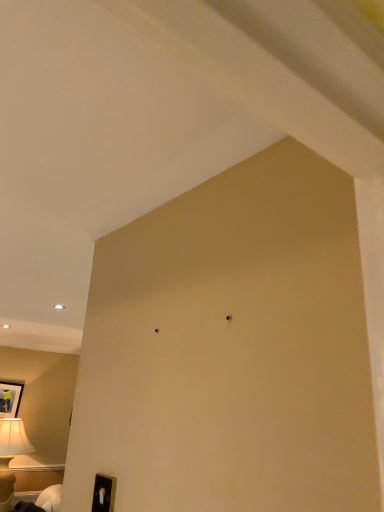
Where is `matte black picture frame at lower left`? The width and height of the screenshot is (384, 512). matte black picture frame at lower left is located at coordinates (10, 398).

The height and width of the screenshot is (512, 384). What do you see at coordinates (10, 398) in the screenshot?
I see `matte black picture frame at lower left` at bounding box center [10, 398].

Identify the location of white glossy lampshade at lower left. This screenshot has height=512, width=384. (41, 500).

What do you see at coordinates (41, 500) in the screenshot? I see `white glossy lampshade at lower left` at bounding box center [41, 500].

Find the location of a particular element. Image resolution: width=384 pixels, height=512 pixels. matte black picture frame at lower left is located at coordinates (10, 398).

Based on their positions, is white glossy lampshade at lower left located to the left or right of matte black picture frame at lower left?

white glossy lampshade at lower left is to the right of matte black picture frame at lower left.

Which is in front, white glossy lampshade at lower left or matte black picture frame at lower left?

Positioned in front is white glossy lampshade at lower left.

Between point (46, 509) and point (6, 389), which one is positioned behind?

The point (6, 389) is farther from the camera.

From the image's perspective, which one is positioned lower, white glossy lampshade at lower left or matte black picture frame at lower left?

white glossy lampshade at lower left appears lower in the image.

From the picture: From a real-world perspective, is white glossy lampshade at lower left positioned above or below matte black picture frame at lower left?

white glossy lampshade at lower left is below matte black picture frame at lower left.

Considering the relative sizes of white glossy lampshade at lower left and matte black picture frame at lower left in the image provided, is white glossy lampshade at lower left thinner than matte black picture frame at lower left?

In fact, white glossy lampshade at lower left might be wider than matte black picture frame at lower left.

In terms of height, does white glossy lampshade at lower left look taller or shorter compared to matte black picture frame at lower left?

Considering their sizes, white glossy lampshade at lower left has less height than matte black picture frame at lower left.

Based on the photo, is white glossy lampshade at lower left bigger or smaller than matte black picture frame at lower left?

Clearly, white glossy lampshade at lower left is larger in size than matte black picture frame at lower left.

Would you say white glossy lampshade at lower left is outside matte black picture frame at lower left?

Yes, white glossy lampshade at lower left is outside of matte black picture frame at lower left.

Can you see white glossy lampshade at lower left touching matte black picture frame at lower left?

white glossy lampshade at lower left is not next to matte black picture frame at lower left, and they're not touching.

Is white glossy lampshade at lower left looking in the opposite direction of matte black picture frame at lower left?

No, white glossy lampshade at lower left is not facing the opposite direction of matte black picture frame at lower left.

Image resolution: width=384 pixels, height=512 pixels. Find the location of `picture frame located above the white glossy lampshade at lower left (from the image's perspective)`. picture frame located above the white glossy lampshade at lower left (from the image's perspective) is located at coordinates (10, 398).

Which object is positioned more to the right, matte black picture frame at lower left or white glossy lampshade at lower left?

white glossy lampshade at lower left.

Which is in front, matte black picture frame at lower left or white glossy lampshade at lower left?

Positioned in front is white glossy lampshade at lower left.

Which is in front, point (0, 405) or point (44, 489)?

The point (44, 489) is more forward.

From the image's perspective, which one is positioned lower, matte black picture frame at lower left or white glossy lampshade at lower left?

From the image's view, white glossy lampshade at lower left is below.

From a real-world perspective, is matte black picture frame at lower left located beneath white glossy lampshade at lower left?

No, from a real-world perspective, matte black picture frame at lower left is not below white glossy lampshade at lower left.

Does matte black picture frame at lower left have a lesser width compared to white glossy lampshade at lower left?

Indeed, matte black picture frame at lower left has a lesser width compared to white glossy lampshade at lower left.

Which of these two, matte black picture frame at lower left or white glossy lampshade at lower left, stands shorter?

With less height is white glossy lampshade at lower left.

Can you confirm if matte black picture frame at lower left is bigger than white glossy lampshade at lower left?

Actually, matte black picture frame at lower left might be smaller than white glossy lampshade at lower left.

Which is correct: matte black picture frame at lower left is inside white glossy lampshade at lower left, or outside of it?

matte black picture frame at lower left is not enclosed by white glossy lampshade at lower left.

Are matte black picture frame at lower left and white glossy lampshade at lower left far apart?

Yes, matte black picture frame at lower left is far from white glossy lampshade at lower left.

Is matte black picture frame at lower left positioned with its back to white glossy lampshade at lower left?

matte black picture frame at lower left does not have its back to white glossy lampshade at lower left.

Identify the location of picture frame behind the white glossy lampshade at lower left. The height and width of the screenshot is (512, 384). [10, 398].

Identify the location of furniture located in front of the matte black picture frame at lower left. (41, 500).

Identify the location of picture frame on the left side of white glossy lampshade at lower left. (10, 398).